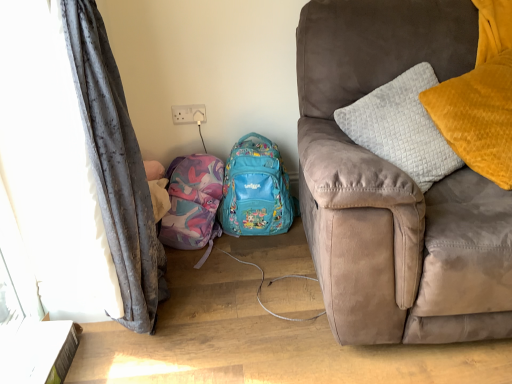
Question: Relative to gray fabric curtain at left, is matte pink fabric backpack at lower left, which ranks as the first backpack in left-to-right order, in front or behind?

Choices:
 (A) behind
 (B) front

Answer: (A)

Question: From the image's perspective, is matte pink fabric backpack at lower left, placed as the 2th backpack when sorted from right to left, located above or below gray fabric curtain at left?

Choices:
 (A) above
 (B) below

Answer: (A)

Question: Estimate the real-world distances between objects in this image. Which object is farther from the teal fabric backpack at center, the first backpack positioned from the right?

Choices:
 (A) suede couch at right
 (B) gray fabric curtain at left
 (C) matte pink fabric backpack at lower left, placed as the 2th backpack when sorted from right to left
 (D) velvet yellow pillow at right

Answer: (D)

Question: Which object is the farthest from the gray fabric curtain at left?

Choices:
 (A) suede couch at right
 (B) velvet yellow pillow at right
 (C) matte pink fabric backpack at lower left, which ranks as the first backpack in left-to-right order
 (D) teal fabric backpack at center, the first backpack positioned from the right

Answer: (B)